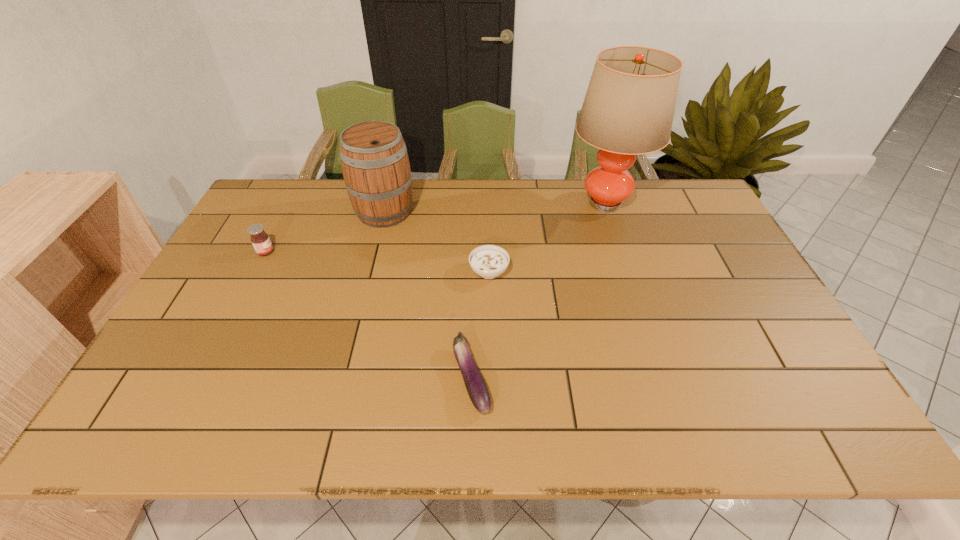
The height and width of the screenshot is (540, 960). I want to click on vacant space that is in between the second object from left to right and the eggplant, so click(428, 295).

Where is `vacant space that is in between the fourth shortest object and the jam`? The image size is (960, 540). vacant space that is in between the fourth shortest object and the jam is located at coordinates (325, 232).

Find the location of a particular element. object that stands as the fourth closest to the soup bowl is located at coordinates (260, 240).

Locate which object is the second closest to the second object from left to right. Please provide its 2D coordinates. Your answer should be formatted as a tuple, i.e. [(x, y)], where the tuple contains the x and y coordinates of a point satisfying the conditions above.

[(488, 261)]

You are a GUI agent. You are given a task and a screenshot of the screen. Output one action in this format:
    pyautogui.click(x=<x>, y=<y>)
    Task: Click on the free spot that satisfies the following two spatial constraints: 1. on the front side of the fourth shortest object; 2. on the right side of the eggplant
    The image size is (960, 540).
    Given the screenshot: What is the action you would take?
    pyautogui.click(x=343, y=378)

This screenshot has height=540, width=960. Identify the location of vacant space that satisfies the following two spatial constraints: 1. on the back side of the eggplant; 2. on the label side of the leftmost object. (473, 252).

This screenshot has width=960, height=540. I want to click on vacant space that satisfies the following two spatial constraints: 1. on the back side of the eggplant; 2. on the label side of the leftmost object, so click(x=473, y=252).

This screenshot has height=540, width=960. What are the coordinates of `vacant space that satisfies the following two spatial constraints: 1. on the back side of the cider; 2. on the left side of the rightmost object` in the screenshot? It's located at (387, 202).

Where is `free space that satisfies the following two spatial constraints: 1. on the front side of the fourth shortest object; 2. on the left side of the nearest object`? free space that satisfies the following two spatial constraints: 1. on the front side of the fourth shortest object; 2. on the left side of the nearest object is located at coordinates (343, 378).

The height and width of the screenshot is (540, 960). I want to click on blank area in the image that satisfies the following two spatial constraints: 1. on the label side of the jam; 2. on the back side of the eggplant, so click(202, 378).